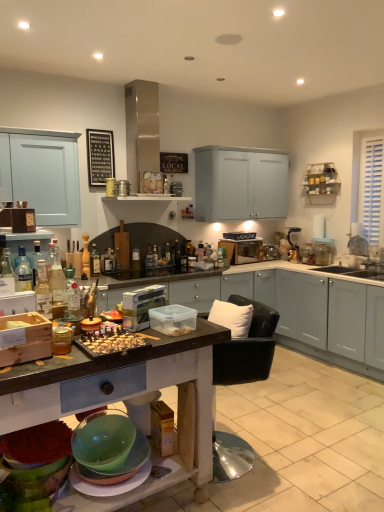
This screenshot has height=512, width=384. In order to click on vacant area that is situated to the right of translucent glass bottle at center, marked as the first bottle in a left-to-right arrangement in this screenshot , I will do `click(106, 277)`.